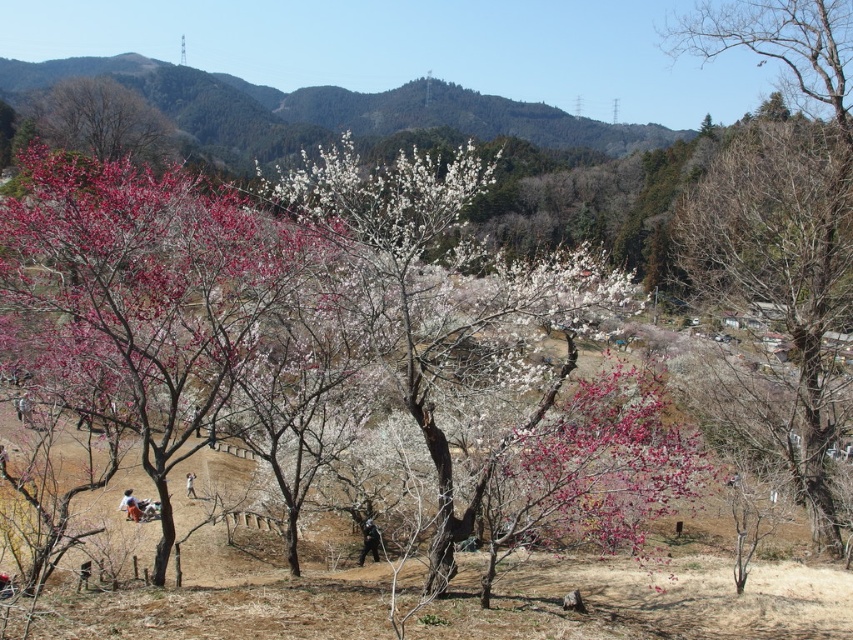
Question: Is matte pink blossoms at center positioned in front of black fabric person at center?

Choices:
 (A) yes
 (B) no

Answer: (A)

Question: Where is bare branches at right located in relation to matte pink blossoms at center in the image?

Choices:
 (A) above
 (B) below

Answer: (A)

Question: Which object is farther from the camera taking this photo?

Choices:
 (A) bare branches at right
 (B) light blue denim jeans at lower center

Answer: (B)

Question: From the image, what is the correct spatial relationship of bare branches at upper left in relation to light blue denim jeans at lower center?

Choices:
 (A) left
 (B) right

Answer: (A)

Question: Which of the following is the closest to the observer?

Choices:
 (A) black fabric person at center
 (B) white cotton shirt at lower center
 (C) matte pink blossoms at center
 (D) bare branches at right

Answer: (C)

Question: Which is farther from the bare branches at right?

Choices:
 (A) bare branches at upper left
 (B) black fabric person at center

Answer: (A)